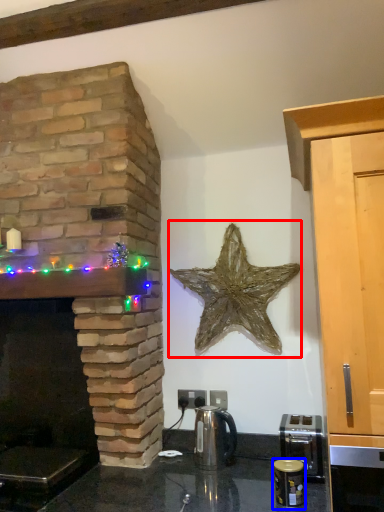
Question: Which object appears closest to the camera in this image, starfish (highlighted by a red box) or appliance (highlighted by a blue box)?

Choices:
 (A) starfish
 (B) appliance

Answer: (B)